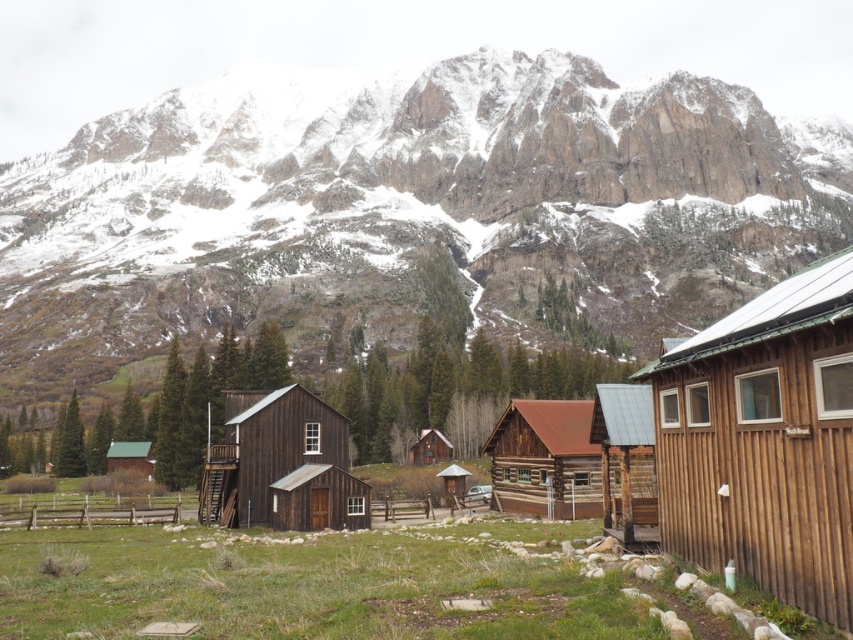
Question: Which point is closer to the camera?

Choices:
 (A) (244, 436)
 (B) (117, 442)
 (C) (560, 442)
 (D) (421, 460)

Answer: (A)

Question: Which point is closer to the camera taking this photo?

Choices:
 (A) (303, 212)
 (B) (343, 445)
 (C) (786, 356)
 (D) (438, 435)

Answer: (C)

Question: Can you confirm if dark brown wooden cabin at center-left is wider than green shingled cabin at lower left?

Choices:
 (A) no
 (B) yes

Answer: (B)

Question: Which point is closer to the camera?

Choices:
 (A) [x=238, y=522]
 (B) [x=428, y=428]
 (C) [x=305, y=294]
 (D) [x=750, y=419]

Answer: (D)

Question: Is snowy rock mountain at upper center in front of rustic wood cabin at center?

Choices:
 (A) yes
 (B) no

Answer: (B)

Question: Can you confirm if dark brown wooden cabin at center-left is positioned to the right of brown wooden cabin at center?

Choices:
 (A) yes
 (B) no

Answer: (B)